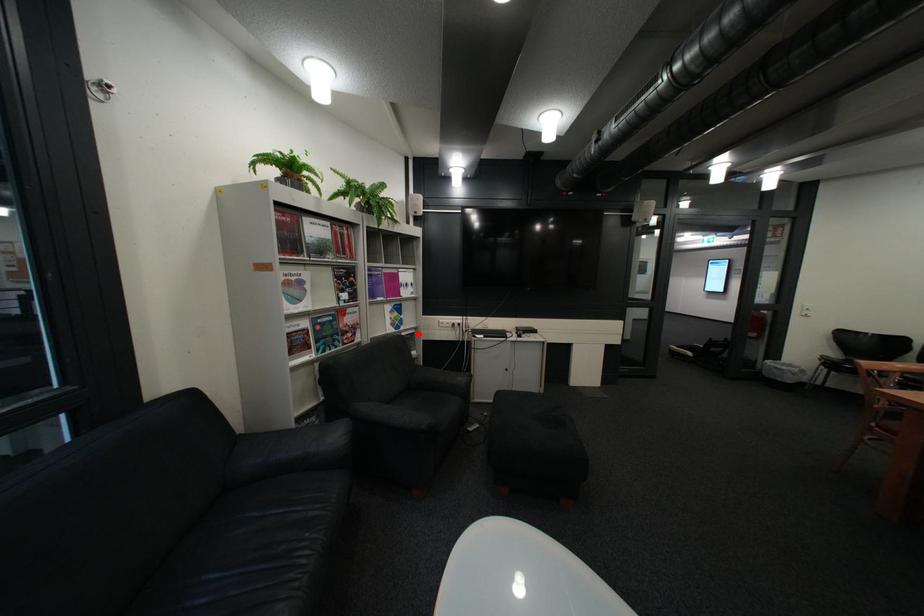
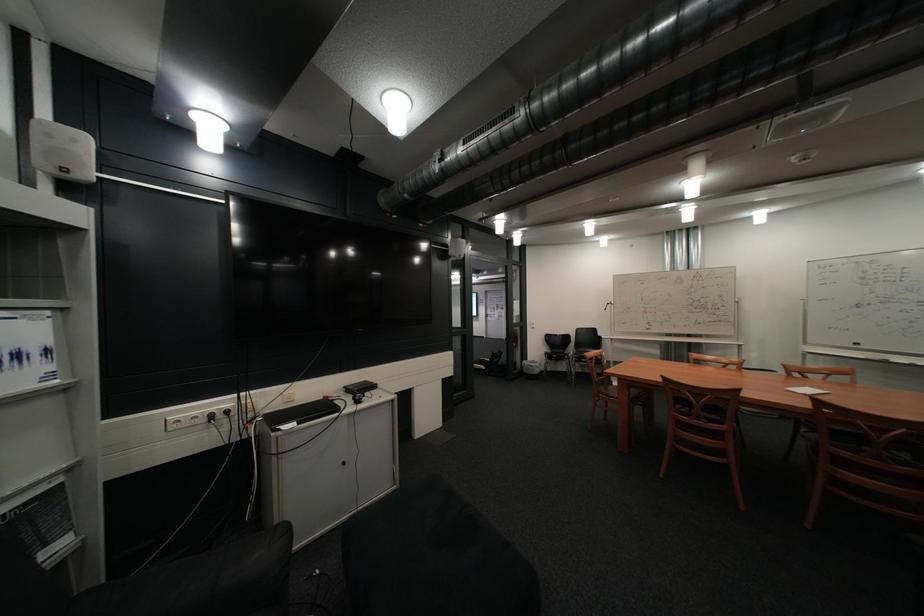
The point at the highlighted location is marked in the first image. Where is the corresponding point in the second image?

(10, 514)